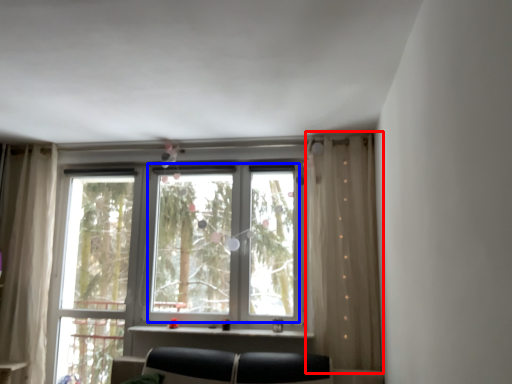
Question: Among these objects, which one is farthest to the camera, curtain (highlighted by a red box) or bay window (highlighted by a blue box)?

Choices:
 (A) curtain
 (B) bay window

Answer: (B)